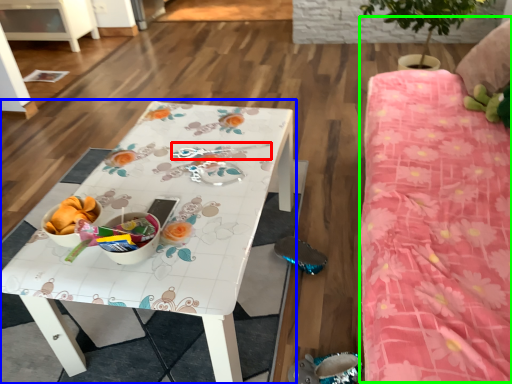
Question: Which object is positioned farthest from twin (highlighted by a red box)? Select from table (highlighted by a blue box) and bed (highlighted by a green box).

Choices:
 (A) table
 (B) bed

Answer: (B)